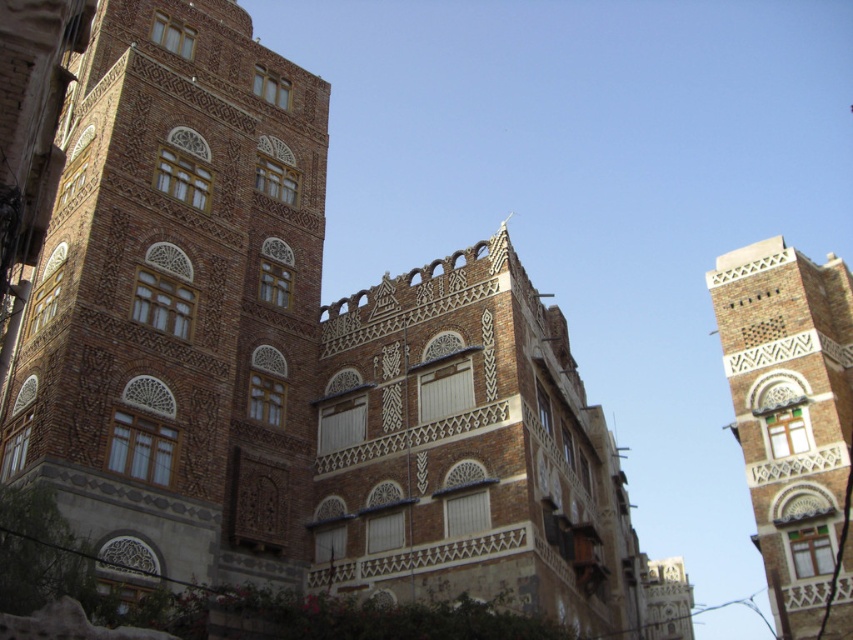
You are an architect examining the traditional structure. You notice the brown textured building at center and the brown textured tower at upper right. Based on their positions, which one is situated higher up in the image?

The brown textured building at center is located above the brown textured tower at upper right, so it is situated higher up in the image.

You are standing in front of a historical building with intricate brickwork. There is a specific point at coordinates point [128,22] that you want to reach. Considering your height is 6 feet, can you physically touch this point without any assistance?

The point [128,22] is 215.83 feet away from you. Since you are only 6 feet tall, you cannot physically reach or touch this point without assistance.

Consider the image. You are standing in front of the building and notice two points marked on the facade. The first point is at coordinates point (247,196), and the second is at point (839,611). Which point is closer to the front of the building?

Point (839,611) is closer to the front of the building because it is in front of point (247,196).